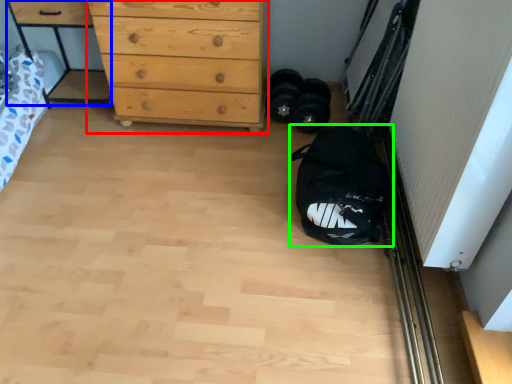
Question: Which is nearer to the chest of drawers (highlighted by a red box)? cabinetry (highlighted by a blue box) or sack (highlighted by a green box).

Choices:
 (A) cabinetry
 (B) sack

Answer: (A)